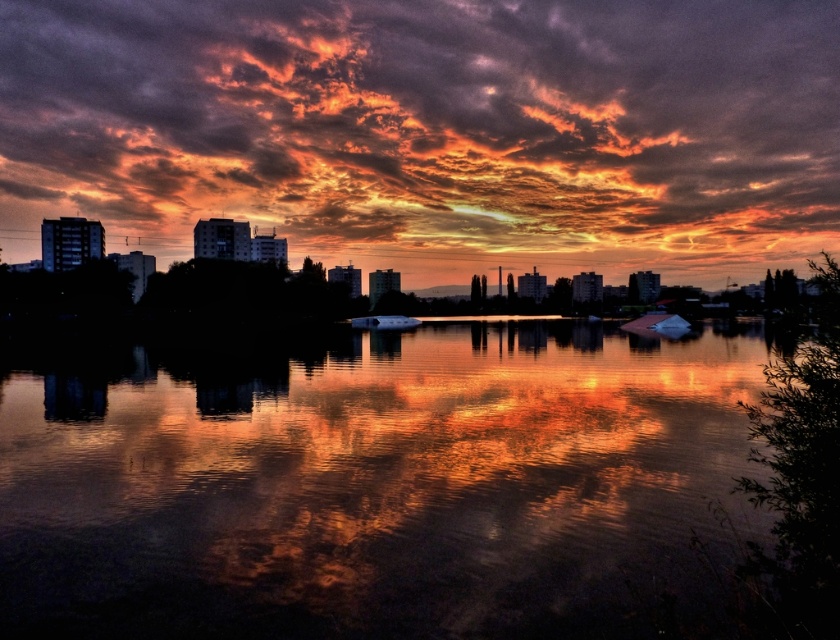
Question: Which object is positioned closest to the reflective glass water at center?

Choices:
 (A) metallic silver boat at center
 (B) orange textured clouds at upper center

Answer: (A)

Question: Observing the image, what is the correct spatial positioning of orange textured clouds at upper center in reference to metallic silver boat at center?

Choices:
 (A) above
 (B) below

Answer: (A)

Question: Observing the image, what is the correct spatial positioning of orange textured clouds at upper center in reference to metallic silver boat at center?

Choices:
 (A) below
 (B) above

Answer: (B)

Question: Which object appears farthest from the camera in this image?

Choices:
 (A) metallic silver boat at center
 (B) orange textured clouds at upper center
 (C) reflective glass water at center

Answer: (B)

Question: Which point is farther from the camera taking this photo?

Choices:
 (A) (340, 193)
 (B) (361, 317)
 (C) (652, 342)

Answer: (A)

Question: Is reflective glass water at center positioned in front of metallic silver boat at center?

Choices:
 (A) no
 (B) yes

Answer: (B)